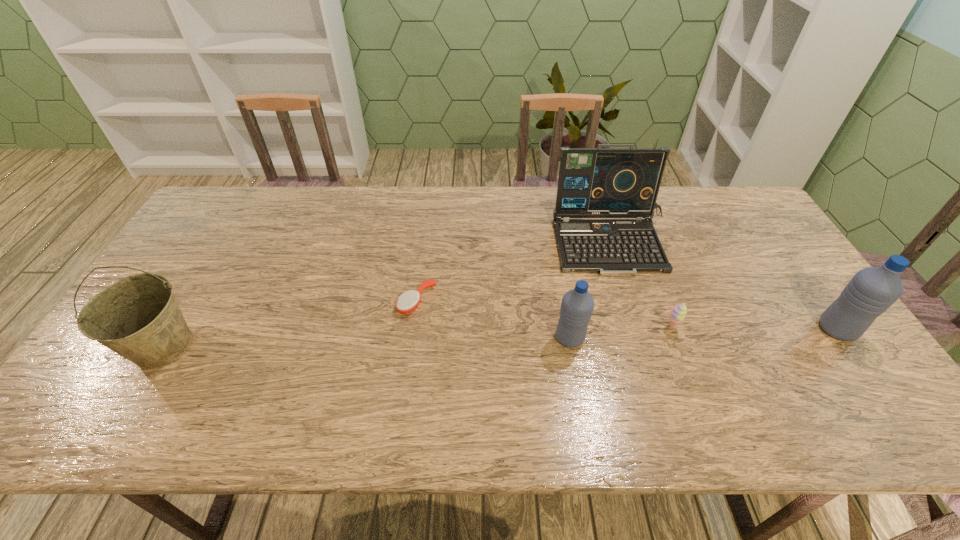
Identify the location of the shorter water bottle. (577, 305).

This screenshot has height=540, width=960. Find the location of `the third shortest object`. the third shortest object is located at coordinates (577, 305).

Where is `the taller water bottle`? Image resolution: width=960 pixels, height=540 pixels. the taller water bottle is located at coordinates (872, 290).

The height and width of the screenshot is (540, 960). In order to click on the rightmost object in this screenshot , I will do `click(872, 290)`.

Locate an element on the screen. The image size is (960, 540). the farthest object is located at coordinates (598, 182).

Find the location of `the fifth tallest object`. the fifth tallest object is located at coordinates (678, 312).

You are a GUI agent. You are given a task and a screenshot of the screen. Output one action in this format:
    pyautogui.click(x=<x>, y=<y>)
    Task: Click on the fifth object from right to left
    
    Given the screenshot: What is the action you would take?
    pyautogui.click(x=409, y=300)

Find the location of a particular element. The width and height of the screenshot is (960, 540). hairbrush is located at coordinates (409, 300).

Where is `the leftmost object`? the leftmost object is located at coordinates (138, 317).

Locate an element on the screen. The width and height of the screenshot is (960, 540). vacant point located on the right of the left water bottle is located at coordinates (679, 338).